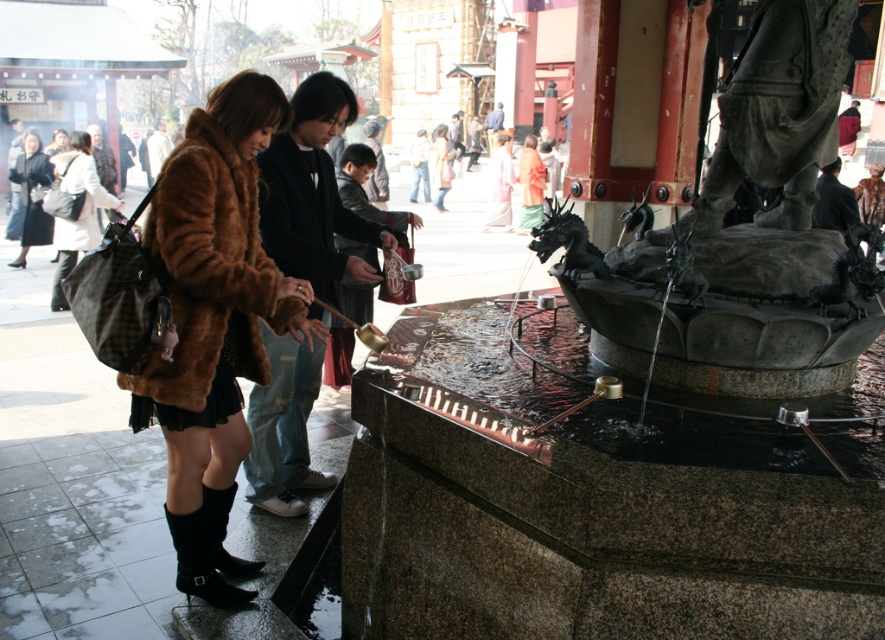
Who is lower down, dark gray stone statue at center or black suede boot at lower left?

Positioned lower is black suede boot at lower left.

Does dark gray stone statue at center appear under black suede boot at lower left?

Actually, dark gray stone statue at center is above black suede boot at lower left.

Find the location of a particular element. This screenshot has width=885, height=640. dark gray stone statue at center is located at coordinates (747, 234).

Locate an element on the screen. dark gray stone statue at center is located at coordinates (747, 234).

Can you confirm if fur coat at left is positioned to the right of black suede boot at lower left?

No, fur coat at left is not to the right of black suede boot at lower left.

The image size is (885, 640). What are the coordinates of `fur coat at left` in the screenshot? It's located at (81, 209).

Does fur coat at left lie in front of black leather boot at lower left?

No.

Is fur coat at left taller than black leather boot at lower left?

Indeed, fur coat at left has a greater height compared to black leather boot at lower left.

Image resolution: width=885 pixels, height=640 pixels. Identify the location of fur coat at left. (81, 209).